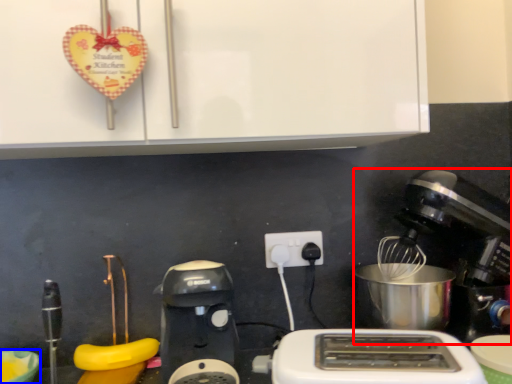
Question: Which object appears farthest to the camera in this image, mixer (highlighted by a red box) or bowl (highlighted by a blue box)?

Choices:
 (A) mixer
 (B) bowl

Answer: (A)